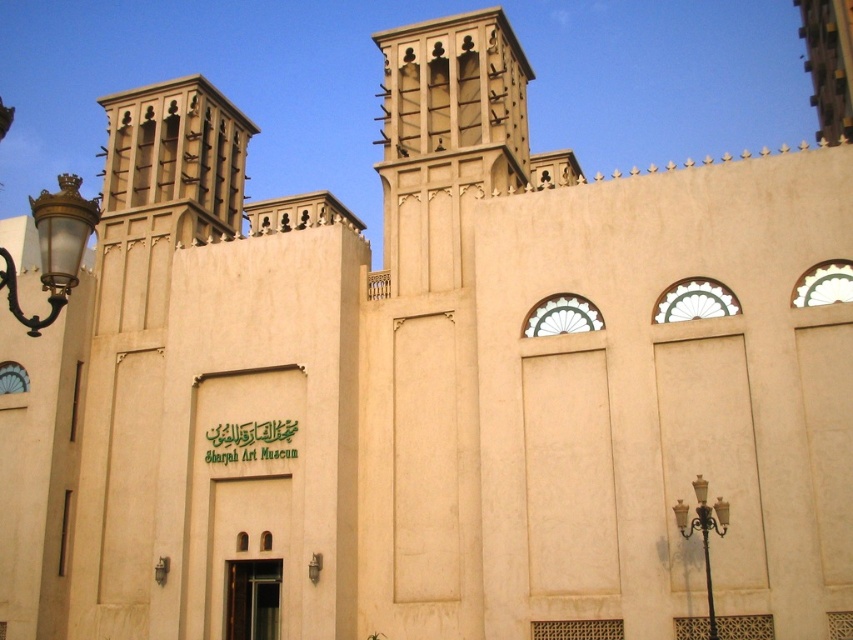
Question: Can you confirm if beige stone wind tower at upper center is bigger than matte brass streetlamp at left?

Choices:
 (A) yes
 (B) no

Answer: (B)

Question: Which point is farther to the camera?

Choices:
 (A) (509, 42)
 (B) (6, 284)

Answer: (A)

Question: Is beige stone wind tower at upper center closer to camera compared to matte brass streetlamp at left?

Choices:
 (A) yes
 (B) no

Answer: (B)

Question: Is beige stone wind tower at upper center positioned behind matte brass streetlamp at left?

Choices:
 (A) no
 (B) yes

Answer: (B)

Question: Which point is closer to the camera?

Choices:
 (A) beige stone wind tower at upper center
 (B) matte brass streetlamp at left

Answer: (B)

Question: Which of the following is the farthest from the observer?

Choices:
 (A) matte brass streetlamp at left
 (B) beige stone wind tower at upper center

Answer: (B)